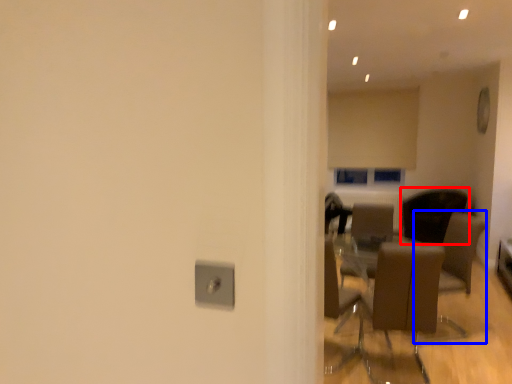
Question: Among these objects, which one is nearest to the camera, chair (highlighted by a red box) or armchair (highlighted by a blue box)?

Choices:
 (A) chair
 (B) armchair

Answer: (B)